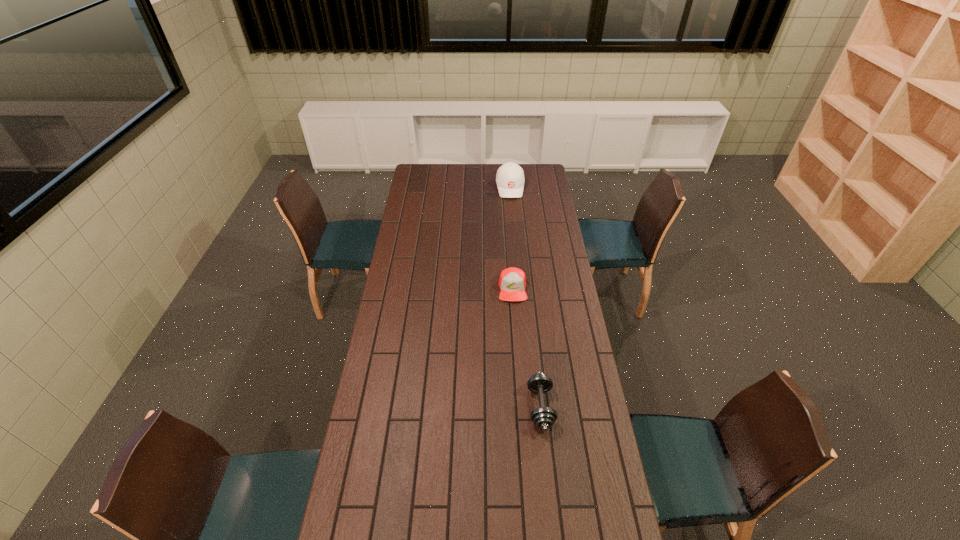
Find the location of a particular element. Image resolution: width=960 pixels, height=540 pixels. dumbbell present at the right edge is located at coordinates (543, 417).

The height and width of the screenshot is (540, 960). What are the coordinates of `object that is at the far right corner` in the screenshot? It's located at (510, 179).

In the image, there is a desktop. Where is `vacant space at the far edge`? Image resolution: width=960 pixels, height=540 pixels. vacant space at the far edge is located at coordinates (444, 176).

Where is `blank area at the left edge`? The image size is (960, 540). blank area at the left edge is located at coordinates (386, 300).

You are a GUI agent. You are given a task and a screenshot of the screen. Output one action in this format:
    pyautogui.click(x=<x>, y=<y>)
    Task: Click on the vacant space at the right edge of the desktop
    
    Given the screenshot: What is the action you would take?
    tap(560, 455)

Identify the location of free spot between the second nearest object and the taller baseball cap. This screenshot has width=960, height=540. (512, 238).

Locate an element on the screen. vacant point located between the nearer baseball cap and the tallest object is located at coordinates (512, 238).

Locate an element on the screen. This screenshot has height=540, width=960. object that is the second closest to the nearest object is located at coordinates (510, 179).

Where is `object that stands as the closest to the shortest object`? The width and height of the screenshot is (960, 540). object that stands as the closest to the shortest object is located at coordinates (543, 417).

You are a GUI agent. You are given a task and a screenshot of the screen. Output one action in this format:
    pyautogui.click(x=<x>, y=<y>)
    Task: Click on the second closest baseball cap to the nearest object
    The image size is (960, 540).
    Given the screenshot: What is the action you would take?
    pyautogui.click(x=510, y=179)